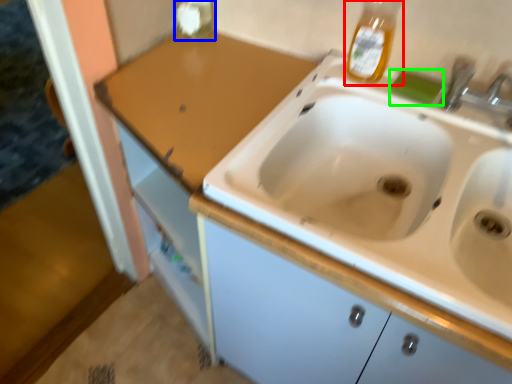
Question: Which object is positioned closest to bottle (highlighted by a red box)? Select from bottle (highlighted by a blue box) and soap (highlighted by a green box).

Choices:
 (A) bottle
 (B) soap

Answer: (B)